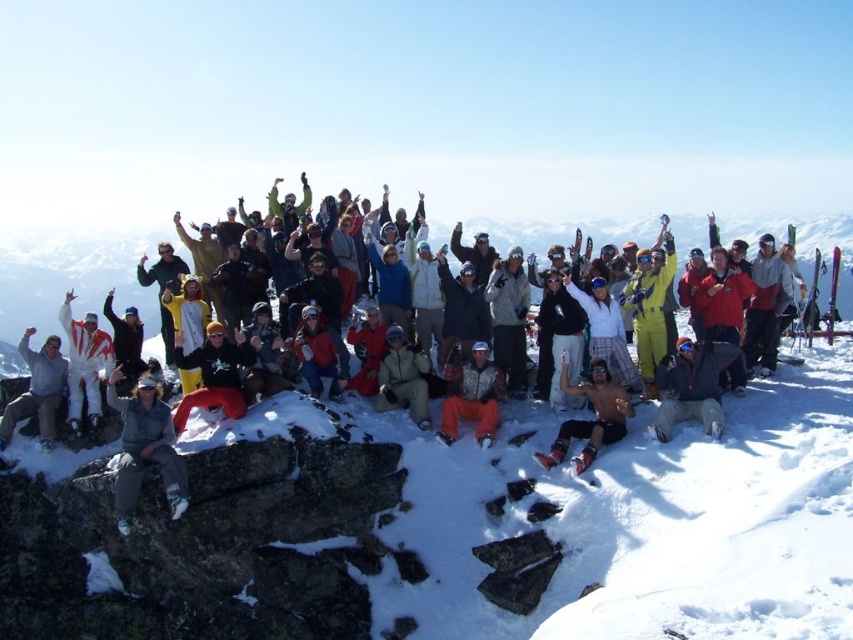
I want to click on white fluffy snow at center, so click(x=447, y=528).

Can you confirm if white fluffy snow at center is positioned below shiny metallic helmet at center?

Correct, white fluffy snow at center is located below shiny metallic helmet at center.

The height and width of the screenshot is (640, 853). I want to click on white fluffy snow at center, so click(447, 528).

Where is `white fluffy snow at center`? white fluffy snow at center is located at coordinates (447, 528).

Can you confirm if matte black jacket at center is bigger than khaki fabric jacket at center?

No, matte black jacket at center is not bigger than khaki fabric jacket at center.

Between matte black jacket at center and khaki fabric jacket at center, which one is positioned lower?

khaki fabric jacket at center is below.

This screenshot has width=853, height=640. I want to click on matte black jacket at center, so click(x=691, y=385).

Does white fluffy snow at center appear on the right side of camouflage pants at center?

Indeed, white fluffy snow at center is positioned on the right side of camouflage pants at center.

Does white fluffy snow at center have a greater height compared to camouflage pants at center?

Correct, white fluffy snow at center is much taller as camouflage pants at center.

The image size is (853, 640). Find the location of `white fluffy snow at center`. white fluffy snow at center is located at coordinates (447, 528).